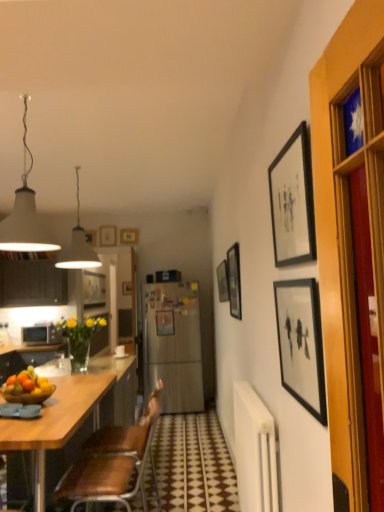
Question: Is brown leather chair at lower left bigger than matte silver microwave at left?

Choices:
 (A) no
 (B) yes

Answer: (B)

Question: Is the depth of brown leather chair at lower left less than that of matte silver microwave at left?

Choices:
 (A) no
 (B) yes

Answer: (B)

Question: Is brown leather chair at lower left smaller than matte silver microwave at left?

Choices:
 (A) yes
 (B) no

Answer: (B)

Question: Is matte silver microwave at left at the back of brown leather chair at lower left?

Choices:
 (A) yes
 (B) no

Answer: (B)

Question: Can you confirm if brown leather chair at lower left is thinner than matte silver microwave at left?

Choices:
 (A) no
 (B) yes

Answer: (A)

Question: Is brown leather chair at lower left not within matte silver microwave at left?

Choices:
 (A) no
 (B) yes

Answer: (B)

Question: Does black matte picture frame at right, which is the seventh picture frame in left-to-right order, lie behind wooden picture frame at upper center, which is the seventh picture frame from front to back?

Choices:
 (A) yes
 (B) no

Answer: (B)

Question: Could you tell me if black matte picture frame at right, the 1th picture frame viewed from the right, is facing wooden picture frame at upper center, which is the 7th picture frame in right-to-left order?

Choices:
 (A) no
 (B) yes

Answer: (A)

Question: Is black matte picture frame at right, which is the seventh picture frame in left-to-right order, thinner than wooden picture frame at upper center, which is the 1th picture frame in left-to-right order?

Choices:
 (A) yes
 (B) no

Answer: (A)

Question: Is black matte picture frame at right, which ranks as the 1th picture frame in front-to-back order, looking in the opposite direction of wooden picture frame at upper center, which is the seventh picture frame from front to back?

Choices:
 (A) yes
 (B) no

Answer: (B)

Question: From a real-world perspective, does black matte picture frame at right, which ranks as the 1th picture frame in front-to-back order, stand above wooden picture frame at upper center, which is the 1th picture frame in left-to-right order?

Choices:
 (A) no
 (B) yes

Answer: (A)

Question: Can you confirm if black matte picture frame at right, the 1th picture frame viewed from the right, is wider than wooden picture frame at upper center, acting as the first picture frame starting from the back?

Choices:
 (A) yes
 (B) no

Answer: (B)

Question: From the image's perspective, is white matte lampshade at upper left, the second lamp viewed from the back, located beneath matte silver microwave at left?

Choices:
 (A) no
 (B) yes

Answer: (A)